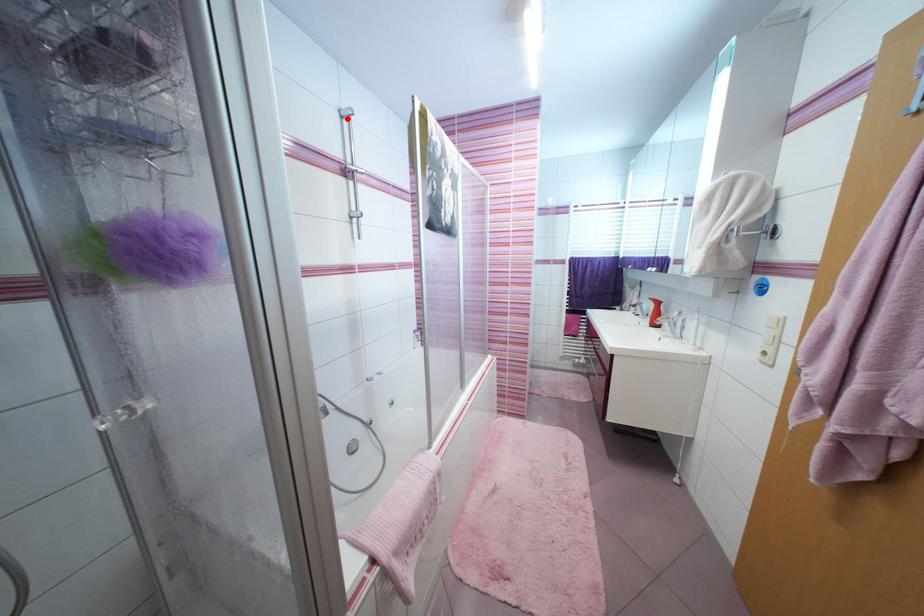
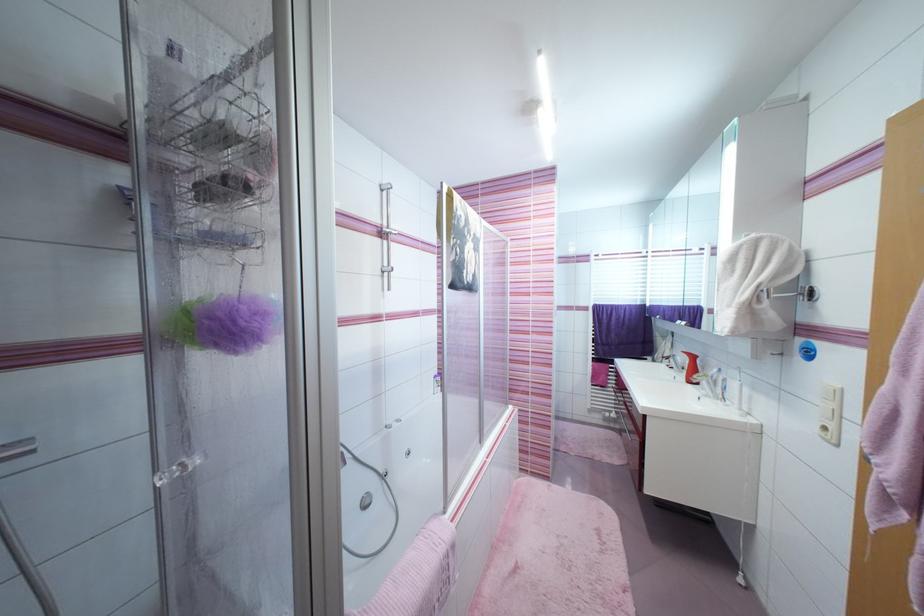
Locate, in the second image, the point that corresponds to the highlighted location in the first image.

(387, 192)